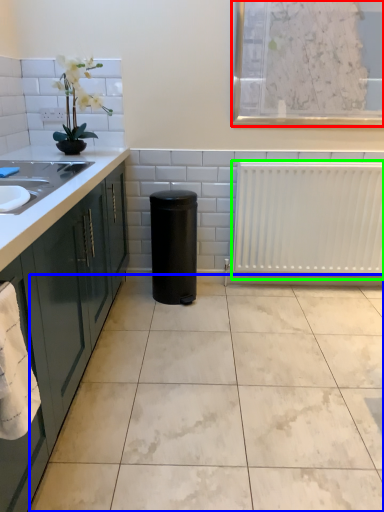
Question: Considering the real-world distances, which object is farthest from window screen (highlighted by a red box)? ceramic tile (highlighted by a blue box) or radiator (highlighted by a green box)?

Choices:
 (A) ceramic tile
 (B) radiator

Answer: (A)